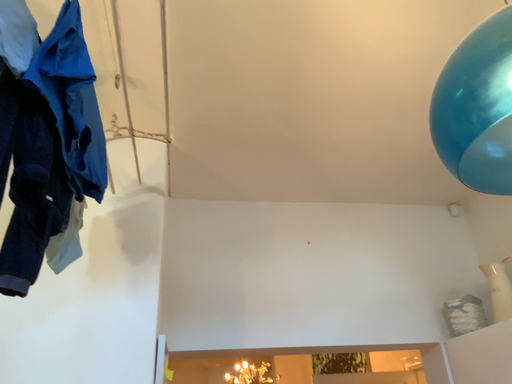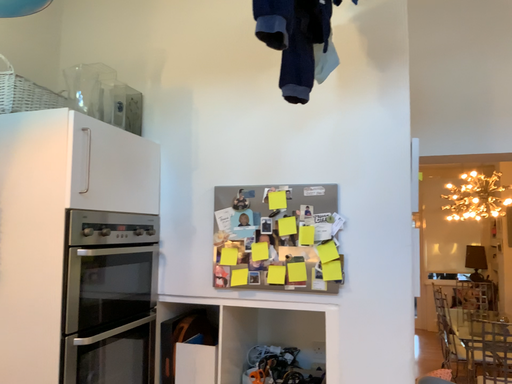
Question: Which way did the camera rotate in the video?

Choices:
 (A) rotated right
 (B) rotated left

Answer: (B)